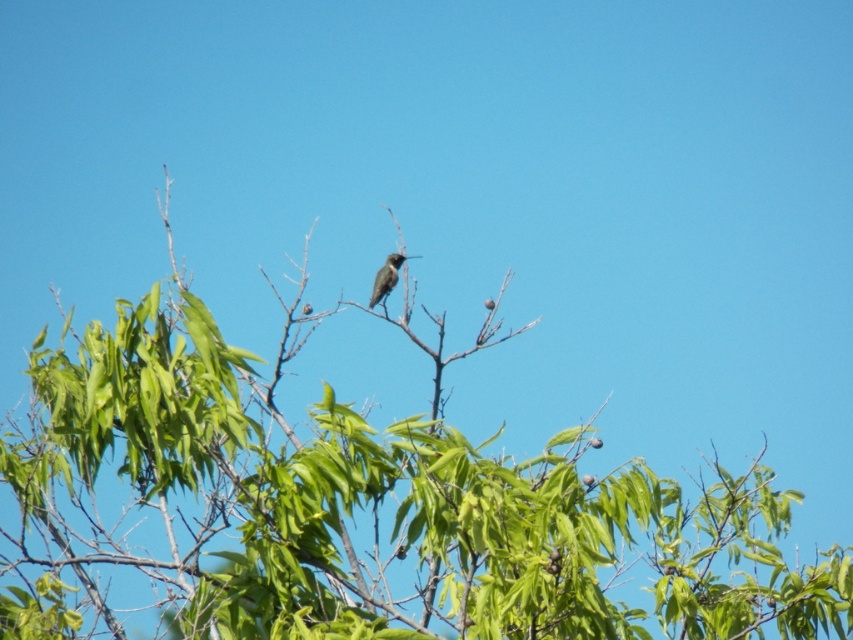
Based on the photo, is green leafy tree at center smaller than shiny brown bird at center?

No, green leafy tree at center is not smaller than shiny brown bird at center.

Does green leafy tree at center appear under shiny brown bird at center?

Yes, green leafy tree at center is below shiny brown bird at center.

I want to click on green leafy tree at center, so click(x=357, y=506).